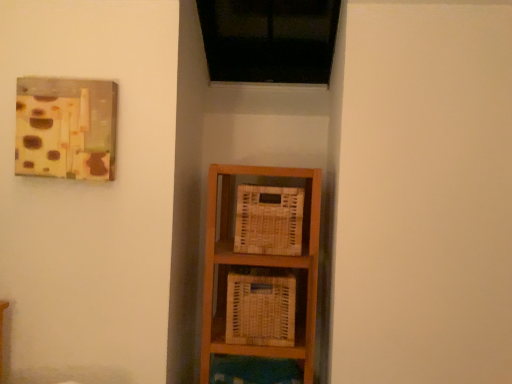
Question: Considering the positions of white woven basket at center, the second basket viewed from the top, and woven wood basket at center, placed as the second basket when sorted from bottom to top, in the image, is white woven basket at center, the second basket viewed from the top, taller or shorter than woven wood basket at center, placed as the second basket when sorted from bottom to top,?

Choices:
 (A) short
 (B) tall

Answer: (B)

Question: From a real-world perspective, is white woven basket at center, the 1th basket when ordered from bottom to top, above or below woven wood basket at center, placed as the second basket when sorted from bottom to top?

Choices:
 (A) below
 (B) above

Answer: (A)

Question: Visually, is white woven basket at center, the second basket viewed from the top, positioned to the left or to the right of woven wood basket at center, marked as the 1th basket in a top-to-bottom arrangement?

Choices:
 (A) left
 (B) right

Answer: (A)

Question: Visually, is woven wood basket at center, placed as the second basket when sorted from bottom to top, positioned to the left or to the right of white woven basket at center, the 1th basket when ordered from bottom to top?

Choices:
 (A) right
 (B) left

Answer: (A)

Question: In terms of size, does woven wood basket at center, marked as the 1th basket in a top-to-bottom arrangement, appear bigger or smaller than white woven basket at center, the 1th basket when ordered from bottom to top?

Choices:
 (A) small
 (B) big

Answer: (A)

Question: From a real-world perspective, is woven wood basket at center, placed as the second basket when sorted from bottom to top, positioned above or below white woven basket at center, the 1th basket when ordered from bottom to top?

Choices:
 (A) above
 (B) below

Answer: (A)

Question: From the image's perspective, is woven wood basket at center, placed as the second basket when sorted from bottom to top, positioned above or below white woven basket at center, the 1th basket when ordered from bottom to top?

Choices:
 (A) above
 (B) below

Answer: (A)